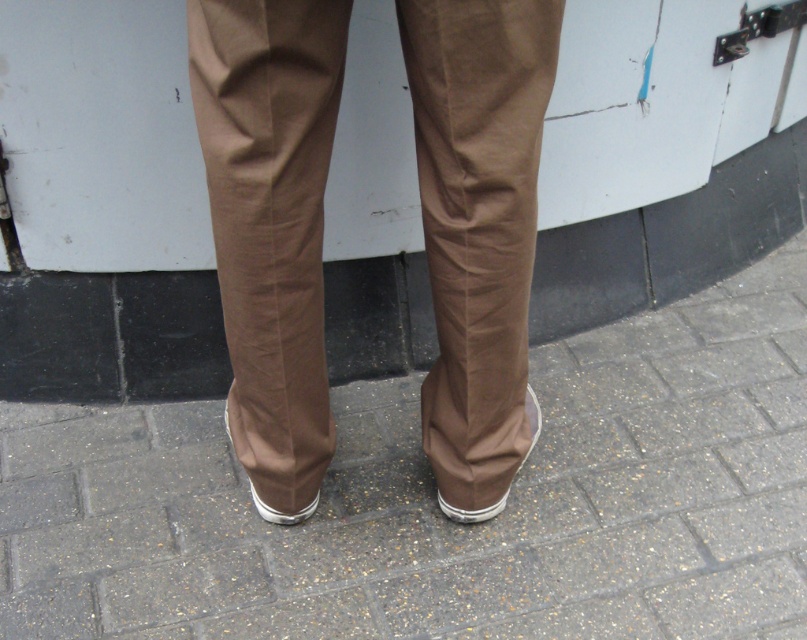
You are designing a shoe rack for two pairs of shoes. The first is a matte brown shoe at lower center and the second is a white rubber shoe at lower center. Based on their widths, which shoe requires a wider space on the rack?

The white rubber shoe at lower center requires a wider space on the rack because its width is greater than the matte brown shoe at lower center.

You are trying to decide which shoe to wear for a hike. You see the matte brown shoe at lower center and the white rubber shoe at lower center in the image. Which one has a higher height?

The matte brown shoe at lower center has a greater height compared to the white rubber shoe at lower center, so it is the higher one.